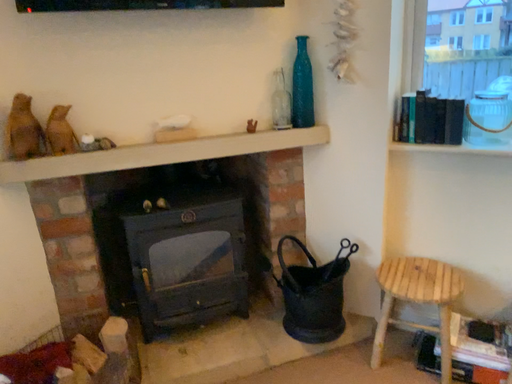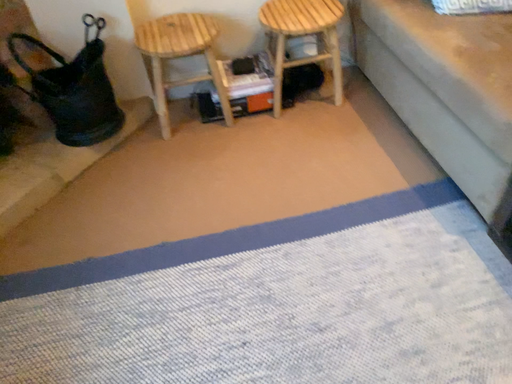
Question: Which way did the camera rotate in the video?

Choices:
 (A) rotated right
 (B) rotated left

Answer: (A)